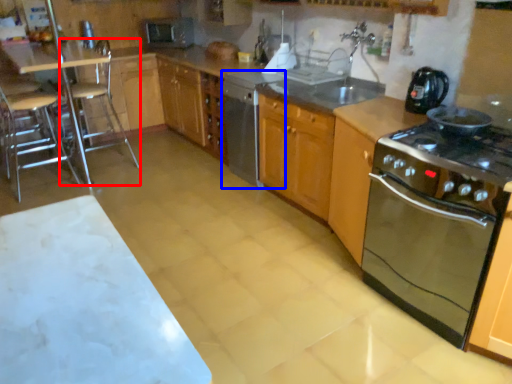
Question: Which object appears farthest to the camera in this image, bar stool (highlighted by a red box) or dish washer (highlighted by a blue box)?

Choices:
 (A) bar stool
 (B) dish washer

Answer: (A)